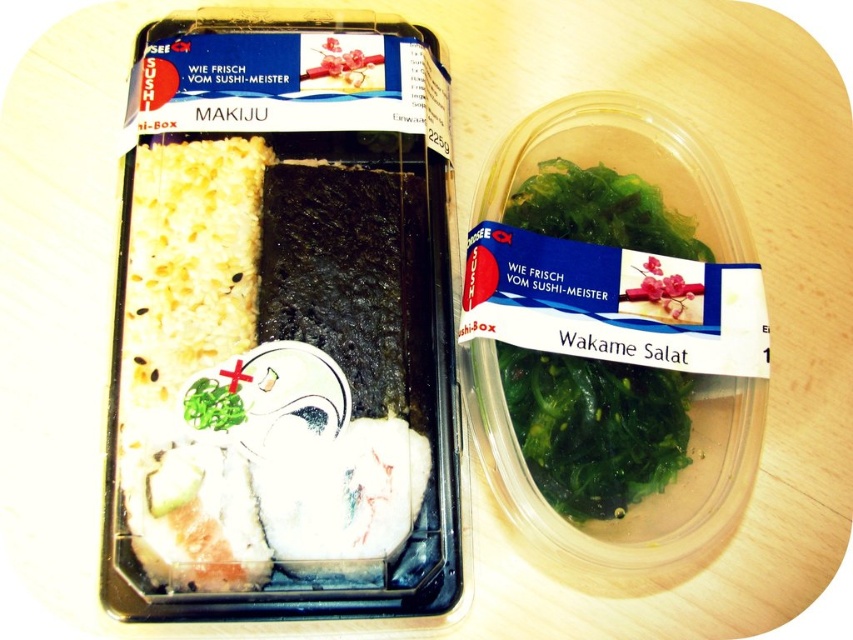
Between white rice at left and green leafy seaweed at center, which one is positioned higher?

green leafy seaweed at center is above.

Can you confirm if white rice at left is bigger than green leafy seaweed at center?

Indeed, white rice at left has a larger size compared to green leafy seaweed at center.

Find the location of `white rice at left`. white rice at left is located at coordinates (265, 368).

Who is taller, green leafy seaweed at center or green leafy wakame salat at right?

With more height is green leafy seaweed at center.

Does green leafy seaweed at center have a greater width compared to green leafy wakame salat at right?

Indeed, green leafy seaweed at center has a greater width compared to green leafy wakame salat at right.

Which is behind, point (515, 360) or point (532, 442)?

The point (515, 360) is behind.

Where is `green leafy seaweed at center`? green leafy seaweed at center is located at coordinates (595, 428).

Is white rice at left to the left of green leafy wakame salat at right from the viewer's perspective?

Correct, you'll find white rice at left to the left of green leafy wakame salat at right.

Consider the image. Who is shorter, white rice at left or green leafy wakame salat at right?

Standing shorter between the two is green leafy wakame salat at right.

Locate an element on the screen. This screenshot has height=640, width=853. white rice at left is located at coordinates (265, 368).